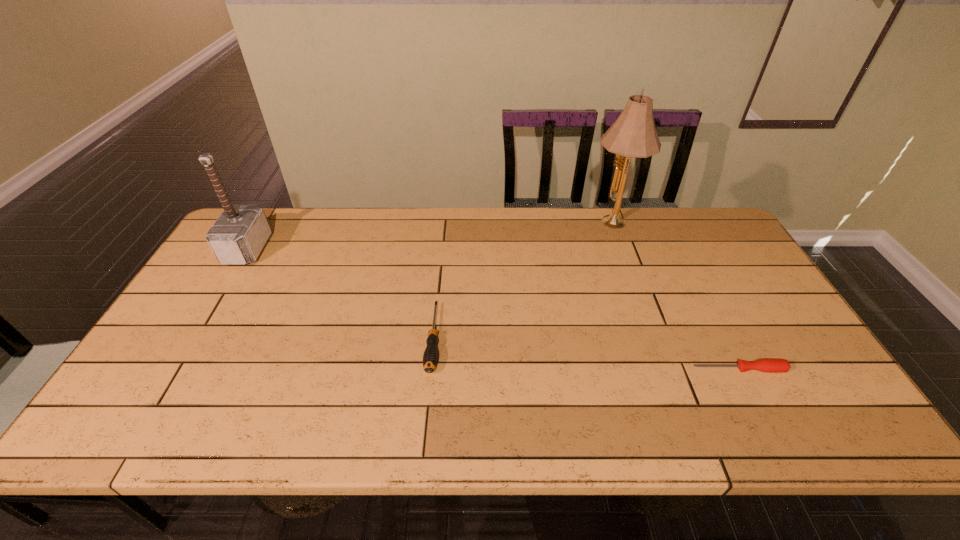
Where is `vacant position at the right edge of the desktop`? The width and height of the screenshot is (960, 540). vacant position at the right edge of the desktop is located at coordinates (771, 329).

Identify the location of free space at the far right corner of the desktop. (723, 228).

Find the location of `vacant region at the near right corner of the desktop`. vacant region at the near right corner of the desktop is located at coordinates (786, 420).

This screenshot has width=960, height=540. What are the coordinates of `free space between the shorter screwdriver and the tallest object` in the screenshot? It's located at (675, 296).

Locate an element on the screen. empty space between the third object from right to left and the second tallest object is located at coordinates (341, 294).

Where is `free point between the leftmost object and the third tallest object`? The width and height of the screenshot is (960, 540). free point between the leftmost object and the third tallest object is located at coordinates (341, 294).

This screenshot has height=540, width=960. I want to click on free space between the shorter screwdriver and the lampshade, so click(x=675, y=296).

Where is `unoccupied area between the tallest object and the shorter screwdriver`? unoccupied area between the tallest object and the shorter screwdriver is located at coordinates (675, 296).

Identify the location of free space that is in between the right screwdriver and the left screwdriver. (587, 354).

The image size is (960, 540). I want to click on free point between the tallest object and the taller screwdriver, so [522, 281].